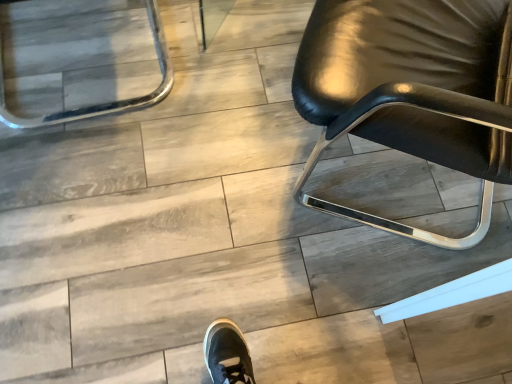
Identify the location of space that is in front of glossy black chair at right, the 2th chair in the left-to-right sequence. (351, 304).